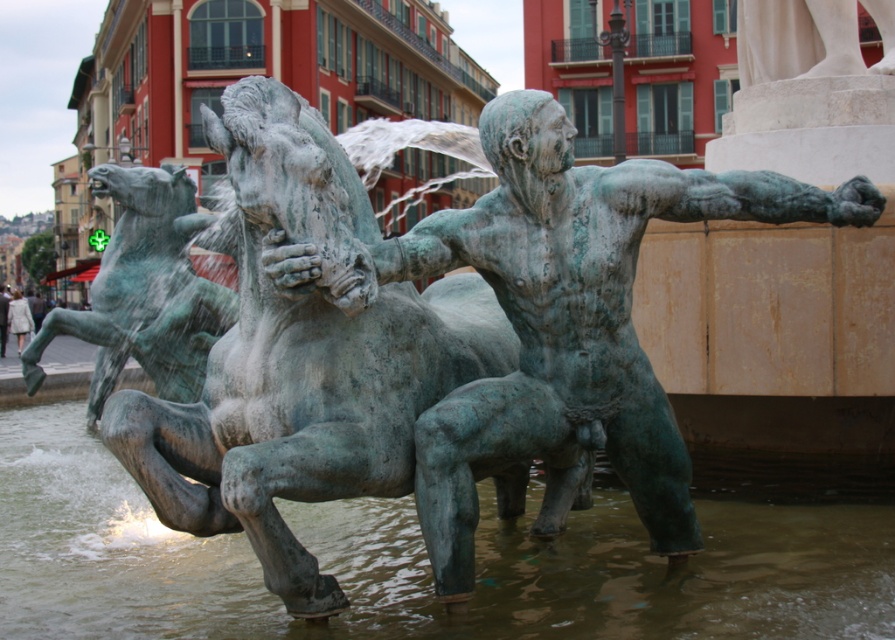
Where is `green patina bronze statue at center`? This screenshot has height=640, width=895. green patina bronze statue at center is located at coordinates (303, 356).

Between green patina bronze statue at center and green patina statue at center, which one appears on the right side from the viewer's perspective?

From the viewer's perspective, green patina statue at center appears more on the right side.

Describe the element at coordinates (303, 356) in the screenshot. This screenshot has width=895, height=640. I see `green patina bronze statue at center` at that location.

Where is `green patina bronze statue at center`? The width and height of the screenshot is (895, 640). green patina bronze statue at center is located at coordinates (303, 356).

Is greenish water at horse front below green patina horse at left?

Correct, greenish water at horse front is located below green patina horse at left.

Find the location of a particular element. greenish water at horse front is located at coordinates (415, 563).

Is point (16, 589) positioned after point (188, 264)?

No, (16, 589) is closer to viewer.

Locate an element on the screen. greenish water at horse front is located at coordinates (415, 563).

Is green patina bronze statue at center taller than green patina horse at left?

In fact, green patina bronze statue at center may be shorter than green patina horse at left.

Is point (254, 228) more distant than point (101, 324)?

No, it is not.

Which is in front, point (310, 593) or point (120, 349)?

Point (310, 593) is in front.

Image resolution: width=895 pixels, height=640 pixels. I want to click on green patina bronze statue at center, so click(x=303, y=356).